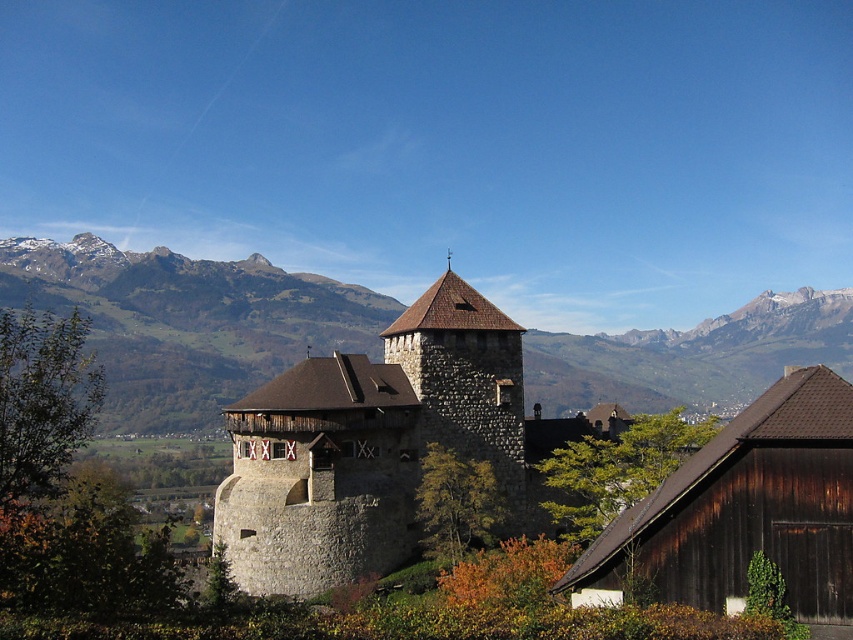
Question: Which object appears farthest from the camera in this image?

Choices:
 (A) brown rocky mountain range at upper center
 (B) brown stone tower at center

Answer: (A)

Question: Among these points, which one is farthest from the camera?

Choices:
 (A) (456, 352)
 (B) (242, 504)
 (C) (339, 336)

Answer: (C)

Question: Does brown rocky mountain range at upper center have a greater width compared to brown stone tower at center?

Choices:
 (A) yes
 (B) no

Answer: (A)

Question: Which point is farther to the camera?

Choices:
 (A) (416, 330)
 (B) (370, 512)
 (C) (152, 369)

Answer: (C)

Question: Does brown rocky mountain range at upper center have a lesser width compared to stone tower at center?

Choices:
 (A) no
 (B) yes

Answer: (A)

Question: Does stone tower at center have a greater width compared to brown stone tower at center?

Choices:
 (A) yes
 (B) no

Answer: (A)